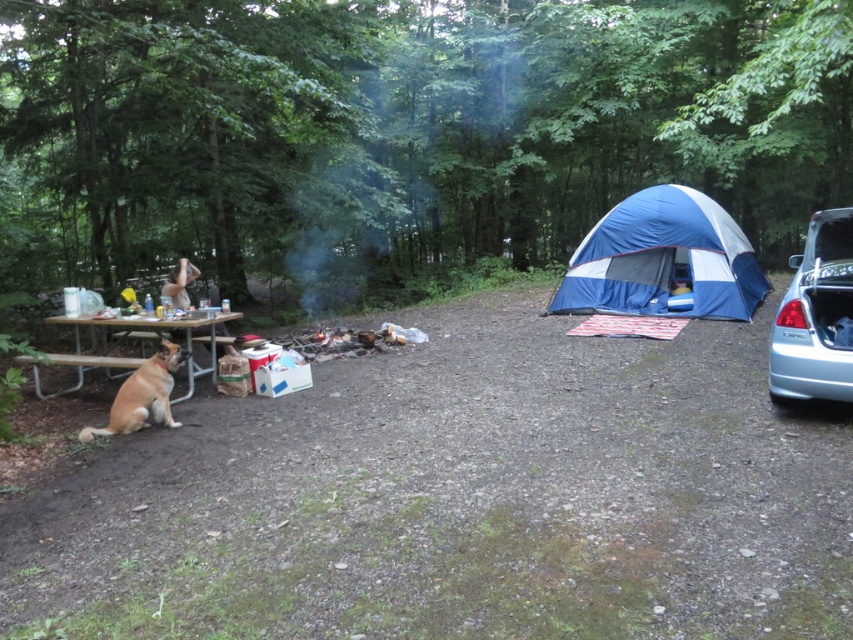
Who is taller, light blue metallic car at right or wooden picnic table at left?

light blue metallic car at right

Does light blue metallic car at right come behind wooden picnic table at left?

That is False.

Is point (808, 273) more distant than point (86, 353)?

No.

Find the location of `light blue metallic car at right`. light blue metallic car at right is located at coordinates (816, 316).

Does blue/white fabric tent at right have a smaller size compared to brown fur dog at left?

No.

Does blue/white fabric tent at right lie behind brown fur dog at left?

Yes, blue/white fabric tent at right is behind brown fur dog at left.

Locate an element on the screen. blue/white fabric tent at right is located at coordinates pyautogui.click(x=663, y=260).

Does wooden picnic table at left appear under brown fur dog at left?

Actually, wooden picnic table at left is above brown fur dog at left.

Which of these two, wooden picnic table at left or brown fur dog at left, stands taller?

wooden picnic table at left

Locate an element on the screen. The width and height of the screenshot is (853, 640). wooden picnic table at left is located at coordinates (125, 339).